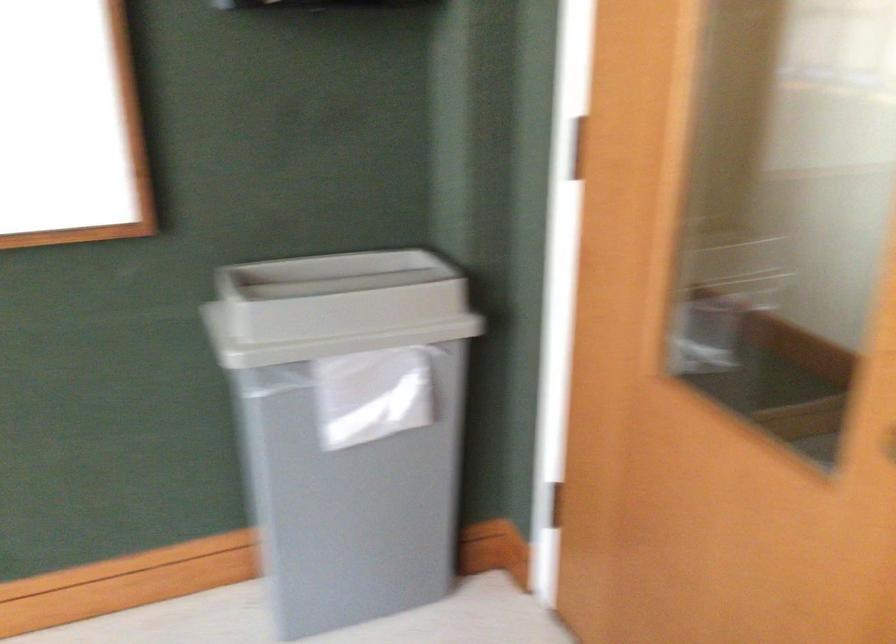
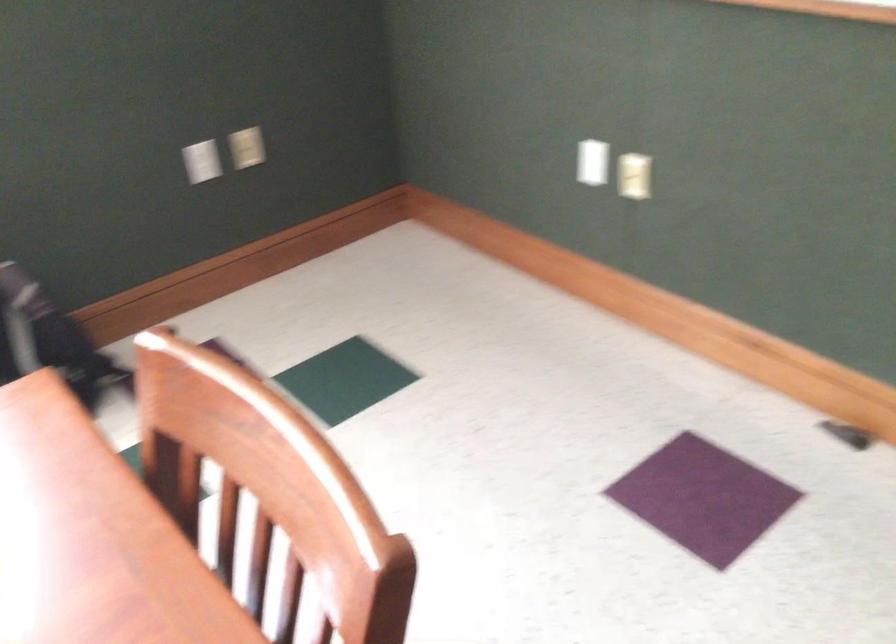
First-person continuous shooting, in which direction is the camera rotating?

The rotation direction of the camera is left-down.